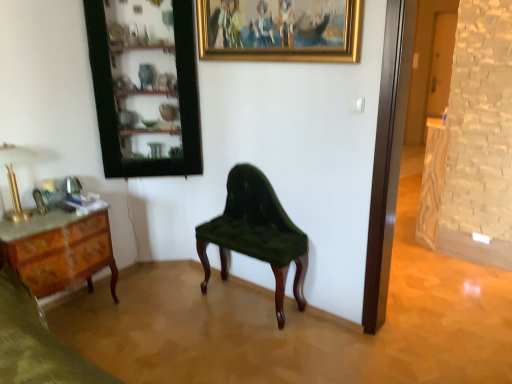
Where is `blank space situated above marble top wood desk at left (from a real-world perspective)`? This screenshot has width=512, height=384. blank space situated above marble top wood desk at left (from a real-world perspective) is located at coordinates (57, 214).